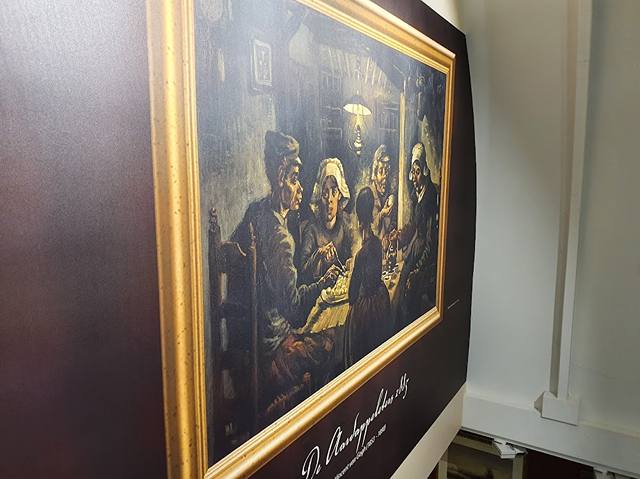
This screenshot has height=479, width=640. Find the location of `left area of gold frame`. left area of gold frame is located at coordinates (173, 240).